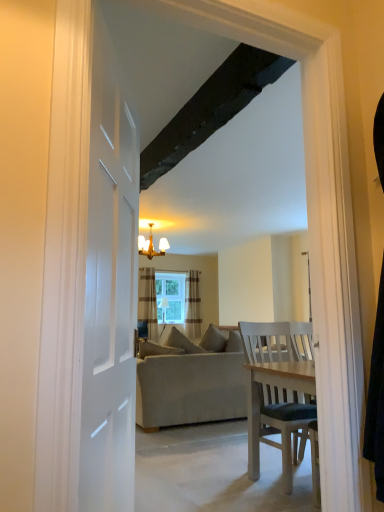
This screenshot has height=512, width=384. I want to click on beige fabric couch at center, so click(x=191, y=388).

Describe the element at coordinates (192, 305) in the screenshot. I see `striped fabric curtain at center, the 2th curtain in the left-to-right sequence` at that location.

The width and height of the screenshot is (384, 512). In order to click on gold metallic chandelier at upper center in this screenshot , I will do `click(151, 245)`.

This screenshot has width=384, height=512. What do you see at coordinates (148, 301) in the screenshot?
I see `brown striped curtain at center, the 2th curtain viewed from the right` at bounding box center [148, 301].

Describe the element at coordinates (170, 297) in the screenshot. I see `clear glass window at center` at that location.

Locate an element on the screen. Image resolution: width=384 pixels, height=512 pixels. beige fabric couch at center is located at coordinates (191, 388).

Is striped fabric curtain at center, positioned as the 1th curtain in right-to-left order, not inside brown striped curtain at center, the 1th curtain in the left-to-right sequence?

Yes, striped fabric curtain at center, positioned as the 1th curtain in right-to-left order, is not within brown striped curtain at center, the 1th curtain in the left-to-right sequence.

Is striped fabric curtain at center, the 2th curtain in the left-to-right sequence, further to the viewer compared to brown striped curtain at center, the 2th curtain viewed from the right?

Yes, striped fabric curtain at center, the 2th curtain in the left-to-right sequence, is further from the camera.

Is brown striped curtain at center, the 1th curtain in the left-to-right sequence, at the back of striped fabric curtain at center, the 2th curtain in the left-to-right sequence?

No, striped fabric curtain at center, the 2th curtain in the left-to-right sequence,'s orientation is not away from brown striped curtain at center, the 1th curtain in the left-to-right sequence.

In the image, is clear glass window at center on the left side or the right side of striped fabric curtain at center, the 2th curtain in the left-to-right sequence?

From the image, it's evident that clear glass window at center is to the left of striped fabric curtain at center, the 2th curtain in the left-to-right sequence.

From the image's perspective, between clear glass window at center and striped fabric curtain at center, the 2th curtain in the left-to-right sequence, which one is located above?

clear glass window at center is shown above in the image.

Which of these two, clear glass window at center or striped fabric curtain at center, the 2th curtain in the left-to-right sequence, is smaller?

clear glass window at center is smaller.

Is clear glass window at center in contact with striped fabric curtain at center, the 2th curtain in the left-to-right sequence?

No, clear glass window at center is not with striped fabric curtain at center, the 2th curtain in the left-to-right sequence.

Which object is positioned more to the left, beige fabric couch at center or gold metallic chandelier at upper center?

Positioned to the left is gold metallic chandelier at upper center.

Looking at this image, does beige fabric couch at center have a larger size compared to gold metallic chandelier at upper center?

Yes.

Is beige fabric couch at center not near gold metallic chandelier at upper center?

Absolutely, beige fabric couch at center is distant from gold metallic chandelier at upper center.

Which is behind, point (162, 405) or point (164, 244)?

The point (164, 244) is more distant.

Can you confirm if striped fabric curtain at center, positioned as the 1th curtain in right-to-left order, is positioned to the right of clear glass window at center?

Yes, striped fabric curtain at center, positioned as the 1th curtain in right-to-left order, is to the right of clear glass window at center.

How many degrees apart are the facing directions of striped fabric curtain at center, the 2th curtain in the left-to-right sequence, and clear glass window at center?

The facing directions of striped fabric curtain at center, the 2th curtain in the left-to-right sequence, and clear glass window at center are 0.00344 degrees apart.

Is striped fabric curtain at center, positioned as the 1th curtain in right-to-left order, aimed at clear glass window at center?

No, striped fabric curtain at center, positioned as the 1th curtain in right-to-left order, does not turn towards clear glass window at center.

Does striped fabric curtain at center, positioned as the 1th curtain in right-to-left order, have a lesser height compared to clear glass window at center?

No.

From a real-world perspective, is gold metallic chandelier at upper center located higher than beige fabric couch at center?

Yes, from a real-world perspective, gold metallic chandelier at upper center is above beige fabric couch at center.

Does gold metallic chandelier at upper center touch beige fabric couch at center?

No.

Can we say gold metallic chandelier at upper center lies outside beige fabric couch at center?

Absolutely, gold metallic chandelier at upper center is external to beige fabric couch at center.

Considering the relative positions of gold metallic chandelier at upper center and striped fabric curtain at center, positioned as the 1th curtain in right-to-left order, in the image provided, is gold metallic chandelier at upper center to the left or to the right of striped fabric curtain at center, positioned as the 1th curtain in right-to-left order,?

gold metallic chandelier at upper center is to the left of striped fabric curtain at center, positioned as the 1th curtain in right-to-left order.

Can you tell me how much gold metallic chandelier at upper center and striped fabric curtain at center, the 2th curtain in the left-to-right sequence, differ in facing direction?

The angle between the facing direction of gold metallic chandelier at upper center and the facing direction of striped fabric curtain at center, the 2th curtain in the left-to-right sequence, is 0.223 degrees.

Considering the sizes of objects gold metallic chandelier at upper center and striped fabric curtain at center, positioned as the 1th curtain in right-to-left order, in the image provided, who is thinner, gold metallic chandelier at upper center or striped fabric curtain at center, positioned as the 1th curtain in right-to-left order,?

With smaller width is striped fabric curtain at center, positioned as the 1th curtain in right-to-left order.

Could you measure the distance between gold metallic chandelier at upper center and striped fabric curtain at center, the 2th curtain in the left-to-right sequence?

They are 1.06 meters apart.

Is gold metallic chandelier at upper center a part of brown striped curtain at center, the 2th curtain viewed from the right?

Actually, gold metallic chandelier at upper center is outside brown striped curtain at center, the 2th curtain viewed from the right.

Between brown striped curtain at center, the 2th curtain viewed from the right, and gold metallic chandelier at upper center, which one has less height?

gold metallic chandelier at upper center.

Between brown striped curtain at center, the 1th curtain in the left-to-right sequence, and gold metallic chandelier at upper center, which one is positioned behind?

brown striped curtain at center, the 1th curtain in the left-to-right sequence, is more distant.

Is point (140, 300) less distant than point (159, 243)?

No, it is behind (159, 243).

Locate an element on the screen. The height and width of the screenshot is (512, 384). curtain above the striped fabric curtain at center, the 2th curtain in the left-to-right sequence (from the image's perspective) is located at coordinates (x=148, y=301).

Image resolution: width=384 pixels, height=512 pixels. I want to click on window that is behind the striped fabric curtain at center, the 2th curtain in the left-to-right sequence, so click(170, 297).

Estimate the real-world distances between objects in this image. Which object is closer to beige fabric couch at center, gold metallic chandelier at upper center or brown striped curtain at center, the 1th curtain in the left-to-right sequence?

gold metallic chandelier at upper center is closer to beige fabric couch at center.

Which object lies further to the anchor point striped fabric curtain at center, positioned as the 1th curtain in right-to-left order, gold metallic chandelier at upper center or brown striped curtain at center, the 1th curtain in the left-to-right sequence?

Among the two, gold metallic chandelier at upper center is located further to striped fabric curtain at center, positioned as the 1th curtain in right-to-left order.

Consider the image. Based on their spatial positions, is striped fabric curtain at center, the 2th curtain in the left-to-right sequence, or gold metallic chandelier at upper center closer to beige fabric couch at center?

gold metallic chandelier at upper center.

Looking at the image, which one is located further to brown striped curtain at center, the 1th curtain in the left-to-right sequence, clear glass window at center or striped fabric curtain at center, the 2th curtain in the left-to-right sequence?

Among the two, striped fabric curtain at center, the 2th curtain in the left-to-right sequence, is located further to brown striped curtain at center, the 1th curtain in the left-to-right sequence.

Based on their spatial positions, is beige fabric couch at center or brown striped curtain at center, the 1th curtain in the left-to-right sequence, closer to clear glass window at center?

brown striped curtain at center, the 1th curtain in the left-to-right sequence, is positioned closer to the anchor clear glass window at center.

Considering their positions, is brown striped curtain at center, the 1th curtain in the left-to-right sequence, positioned further to striped fabric curtain at center, the 2th curtain in the left-to-right sequence, than gold metallic chandelier at upper center?

gold metallic chandelier at upper center is positioned further to the anchor striped fabric curtain at center, the 2th curtain in the left-to-right sequence.

From the image, which object appears to be farther from beige fabric couch at center, brown striped curtain at center, the 2th curtain viewed from the right, or clear glass window at center?

Based on the image, clear glass window at center appears to be further to beige fabric couch at center.

Which object lies nearer to the anchor point gold metallic chandelier at upper center, brown striped curtain at center, the 1th curtain in the left-to-right sequence, or clear glass window at center?

Among the two, brown striped curtain at center, the 1th curtain in the left-to-right sequence, is located nearer to gold metallic chandelier at upper center.

At what (x,y) coordinates should I click in order to perform the action: click on light fixture between beige fabric couch at center and clear glass window at center from front to back. Please return your answer as a coordinate pair (x, y). Looking at the image, I should click on (151, 245).

You are a GUI agent. You are given a task and a screenshot of the screen. Output one action in this format:
    pyautogui.click(x=<x>, y=<y>)
    Task: Click on the light fixture between beige fabric couch at center and brown striped curtain at center, the 2th curtain viewed from the right, in the front-back direction
    
    Given the screenshot: What is the action you would take?
    pyautogui.click(x=151, y=245)

You are a GUI agent. You are given a task and a screenshot of the screen. Output one action in this format:
    pyautogui.click(x=<x>, y=<y>)
    Task: Click on the light fixture between beige fabric couch at center and striped fabric curtain at center, positioned as the 1th curtain in right-to-left order, along the z-axis
    
    Given the screenshot: What is the action you would take?
    point(151,245)

Find the location of `curtain between beige fabric couch at center and striped fabric curtain at center, positioned as the 1th curtain in right-to-left order, in the front-back direction`. curtain between beige fabric couch at center and striped fabric curtain at center, positioned as the 1th curtain in right-to-left order, in the front-back direction is located at coordinates (148, 301).